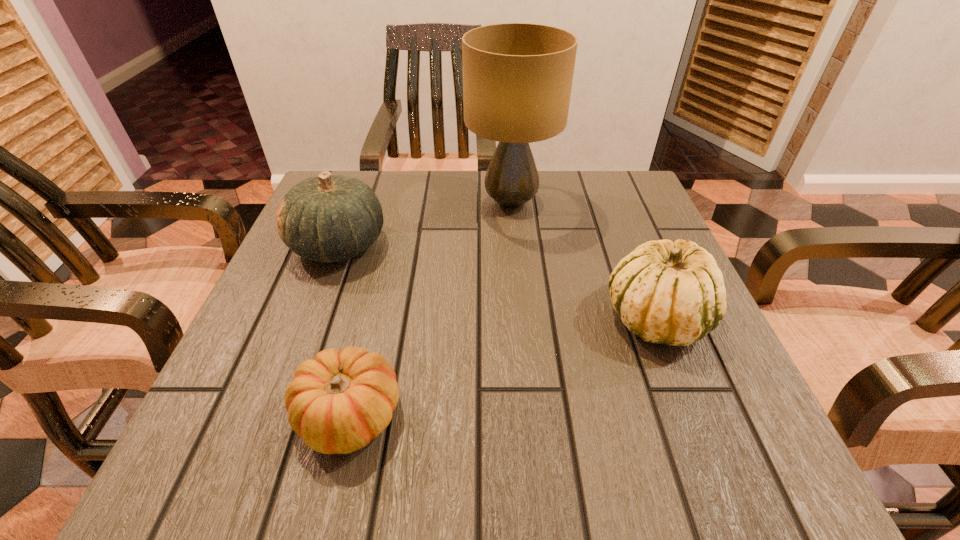
Locate an element on the screen. Image resolution: width=960 pixels, height=540 pixels. the tallest object is located at coordinates (517, 77).

In order to click on the third object from left to right in this screenshot , I will do `click(517, 77)`.

At what (x,y) coordinates should I click in order to perform the action: click on the farthest gourd. Please return your answer as a coordinate pair (x, y). The width and height of the screenshot is (960, 540). Looking at the image, I should click on (328, 218).

Identify the location of the second farthest gourd. This screenshot has width=960, height=540. [x=667, y=292].

Where is `the third farthest object`? the third farthest object is located at coordinates (667, 292).

The height and width of the screenshot is (540, 960). Find the location of `the shortest object`. the shortest object is located at coordinates (338, 402).

Where is `the shortest gourd`? The width and height of the screenshot is (960, 540). the shortest gourd is located at coordinates pyautogui.click(x=338, y=402).

Identify the location of vacant region located 0.400m on the front of the tallest object. The image size is (960, 540). (528, 388).

Find the location of a particular element. This screenshot has height=540, width=960. vacant space located 0.090m on the back of the farthest gourd is located at coordinates (x=357, y=195).

Locate an element on the screen. free space located on the back of the rightmost object is located at coordinates (635, 263).